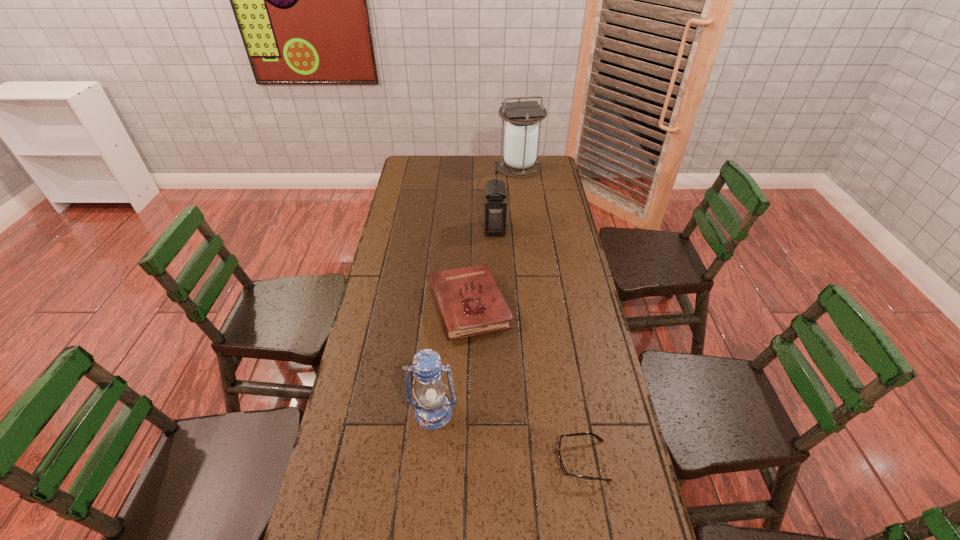
Locate an element on the screen. This screenshot has width=960, height=540. spectacles that is at the right edge is located at coordinates (585, 433).

I want to click on object situated at the far right corner, so click(x=521, y=132).

You are a GUI agent. You are given a task and a screenshot of the screen. Output one action in this format:
    pyautogui.click(x=<x>, y=<y>)
    Task: Click on the vacant space at the far edge of the desktop
    
    Given the screenshot: What is the action you would take?
    [447, 177]

Where is `free space at the left edge`? free space at the left edge is located at coordinates (372, 350).

In the image, there is a desktop. Find the location of `vacant space at the right edge`. vacant space at the right edge is located at coordinates (591, 424).

You are a GUI agent. You are given a task and a screenshot of the screen. Output one action in this format:
    pyautogui.click(x=<x>, y=<y>)
    Task: Click on the free space at the far left corner
    
    Given the screenshot: What is the action you would take?
    tap(419, 164)

Where is `vacant region between the nearest lantern and the spectacles`? vacant region between the nearest lantern and the spectacles is located at coordinates (508, 436).

Identify the location of free space between the hardback book and the tallest lantern. (494, 237).

At what (x,y) coordinates should I click in order to perform the action: click on free spot between the shortest object and the fourth tallest object. Please return your answer as a coordinate pair (x, y). The width and height of the screenshot is (960, 540). Looking at the image, I should click on (526, 383).

Identify the location of empty location between the third nearest object and the tallest lantern. (494, 237).